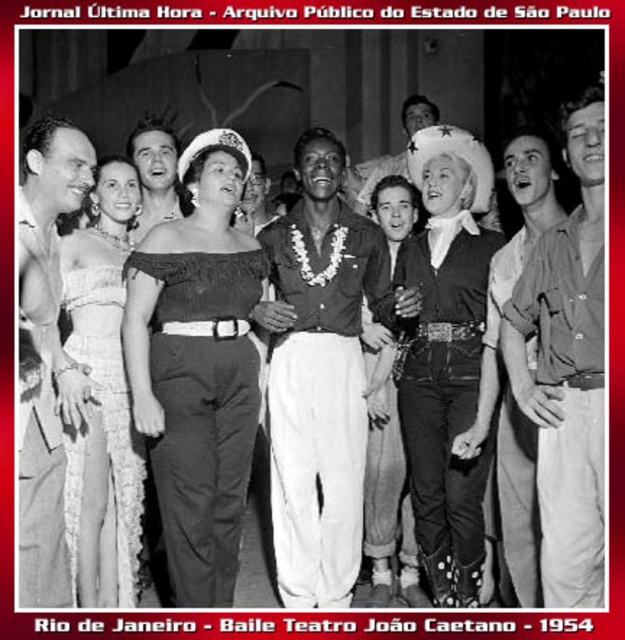
You are a photographer at the event and want to capture a photo of both the lace fabric dress at left and the smooth skin shirt at left in the same frame. Given that your camera has a focal length of 50mm and a sensor size of 24x36mm, what is the minimum distance you need to stand from the subjects to ensure both are fully visible in the frame?

The lace fabric dress at left and smooth skin shirt at left are 24.45 inches apart. To capture both in the same frame with a 50mm lens and 24x36mm sensor, the minimum distance required is calculated using the formula for field of view. The horizontal field of view at 50mm is approximately 46 degrees. Using trigonometry, the distance would be approximately 24.45 inches divided by the tangent of half the angle of view. This results in roughly 28 inches from the subjects to ensure both are fully visible.

In the photo, there are two smooth leather jackets at the center. Which one is closer to you, the smooth brown leather jacket at center or the smooth leather jacket at center?

The smooth brown leather jacket at center is closer to the viewer than the smooth leather jacket at center.